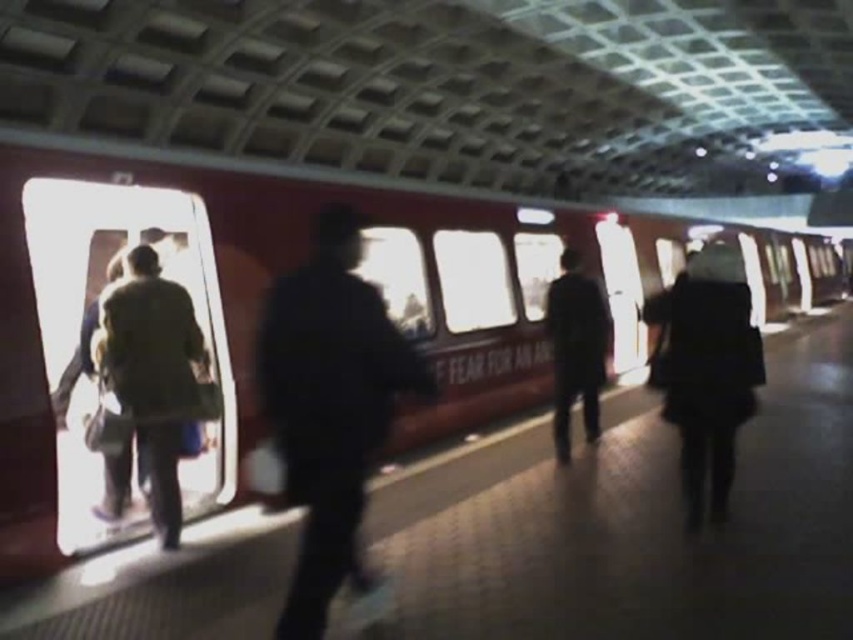
Based on the photo, which is above, dark blue uniform at center or dark green fabric jacket at right?

dark green fabric jacket at right is higher up.

Which of these two, dark blue uniform at center or dark green fabric jacket at right, stands taller?

With more height is dark blue uniform at center.

Identify the location of dark blue uniform at center. (329, 406).

Is red glossy train at center to the left of green fabric coat at left from the viewer's perspective?

No, red glossy train at center is not to the left of green fabric coat at left.

Between red glossy train at center and green fabric coat at left, which one is positioned lower?

green fabric coat at left

Where is `red glossy train at center`? The width and height of the screenshot is (853, 640). red glossy train at center is located at coordinates [253, 310].

Does dark green fabric jacket at right appear on the left side of dark blue jacket at center?

No, dark green fabric jacket at right is not to the left of dark blue jacket at center.

Consider the image. Can you confirm if dark green fabric jacket at right is wider than dark blue jacket at center?

Yes.

In the scene shown: Who is more forward, (722, 276) or (563, 420)?

Point (722, 276) is in front.

Locate an element on the screen. This screenshot has height=640, width=853. dark green fabric jacket at right is located at coordinates (706, 371).